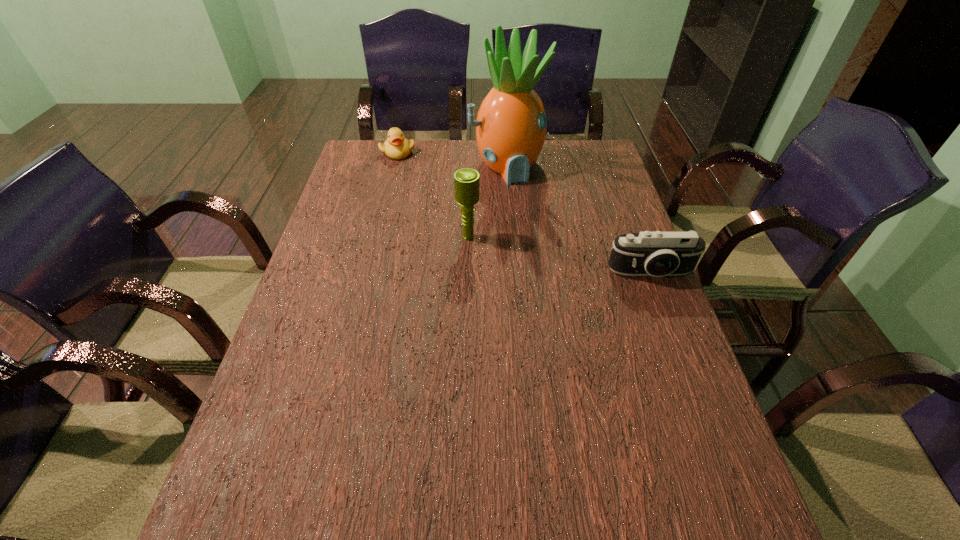
This screenshot has width=960, height=540. I want to click on empty space between the camera and the third shortest object, so click(x=560, y=255).

You are a GUI agent. You are given a task and a screenshot of the screen. Output one action in this format:
    pyautogui.click(x=<x>, y=<y>)
    Task: Click on the free area in between the pineapple and the shortest object
    The height and width of the screenshot is (540, 960).
    Given the screenshot: What is the action you would take?
    pyautogui.click(x=452, y=159)

This screenshot has height=540, width=960. I want to click on free space between the tallest object and the second nearest object, so click(x=488, y=201).

Locate an element on the screen. The width and height of the screenshot is (960, 540). vacant area that lies between the leftmost object and the tallest object is located at coordinates tap(452, 159).

Find the location of a particular element. This screenshot has width=960, height=540. object that is the third closest to the shortest object is located at coordinates (657, 254).

Identify which object is the third closest to the nearest object. Please provide its 2D coordinates. Your answer should be formatted as a tuple, i.e. [(x, y)], where the tuple contains the x and y coordinates of a point satisfying the conditions above.

[(397, 147)]

Locate an element on the screen. The height and width of the screenshot is (540, 960). vacant region that satisfies the following two spatial constraints: 1. on the front side of the shortest object; 2. on the left side of the microphone is located at coordinates (376, 237).